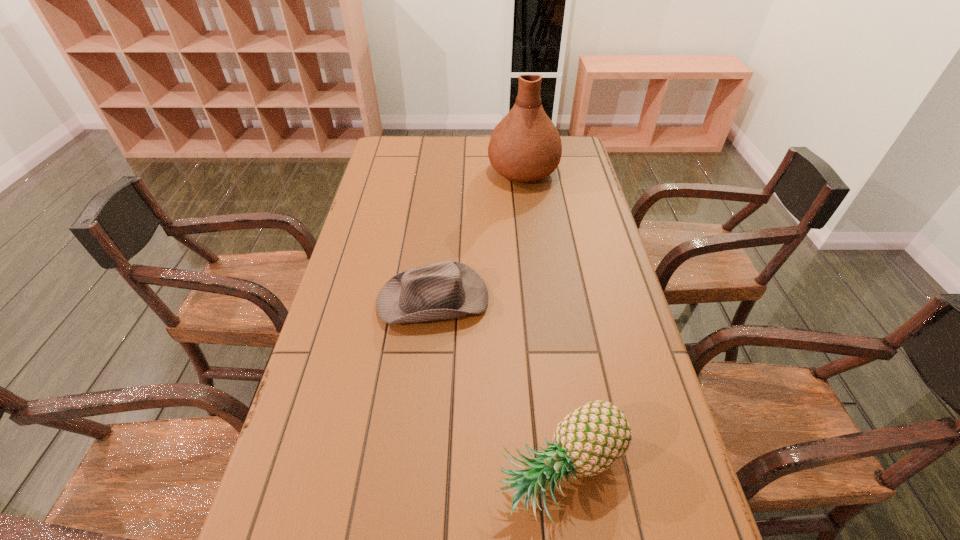
Identify the location of pitcher. This screenshot has width=960, height=540. (525, 146).

Identify the location of the tallest object. This screenshot has width=960, height=540. (525, 146).

Find the location of a particular element. The height and width of the screenshot is (540, 960). the nearest object is located at coordinates (589, 440).

The image size is (960, 540). Identify the location of the second shortest object. (589, 440).

Identify the location of the shortest object. (445, 290).

Image resolution: width=960 pixels, height=540 pixels. What are the coordinates of `the leftmost object` in the screenshot? It's located at (445, 290).

Image resolution: width=960 pixels, height=540 pixels. In order to click on free region located on the side of the pitcher with the handle in this screenshot , I will do `click(519, 141)`.

Find the location of a particular element. This screenshot has height=540, width=960. vacant space located 0.310m on the back of the pineapple is located at coordinates (540, 311).

This screenshot has width=960, height=540. I want to click on free spot located on the front of the leftmost object, so click(x=424, y=387).

Locate an element on the screen. object that is positioned at the far edge is located at coordinates (525, 146).